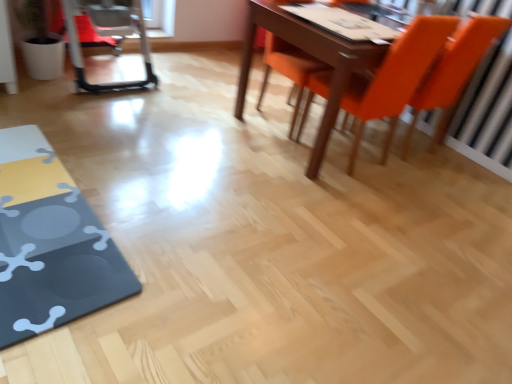
Locate an element on the screen. The image size is (512, 384). free space in front of orange matte chair at upper right, the 2th chair positioned from the right is located at coordinates (352, 195).